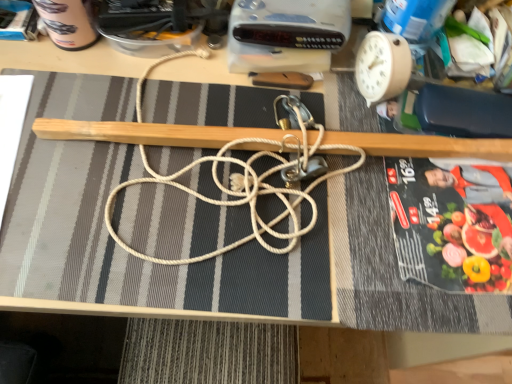
Locate an element on the screen. vacant space situated above black glossy paperback book at right, the 1th paperback book viewed from the front (from a real-world perspective) is located at coordinates (457, 196).